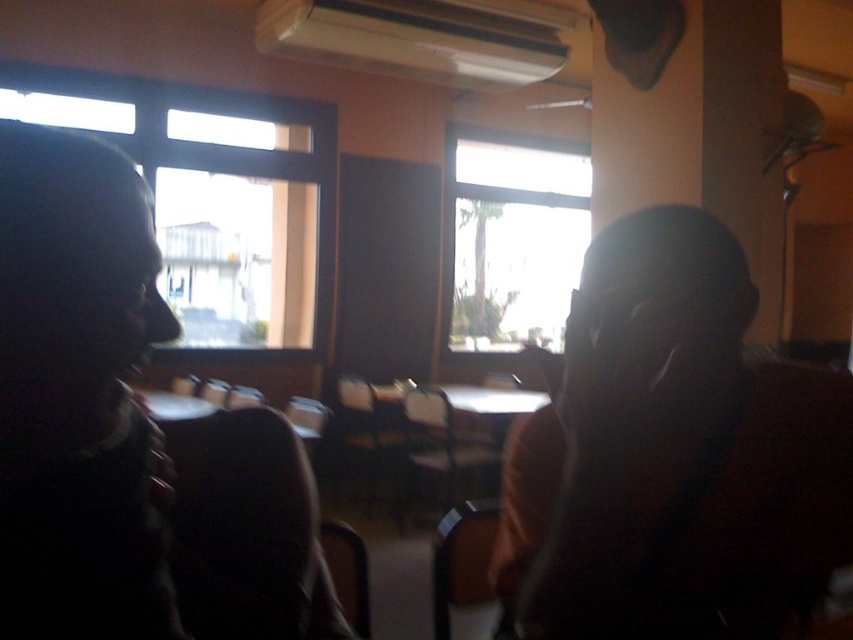
Question: Is dark matte head at center bigger than transparent glass window at center?

Choices:
 (A) no
 (B) yes

Answer: (A)

Question: Which point is closer to the camera?

Choices:
 (A) transparent glass window at left
 (B) dark matte head at center
 (C) transparent glass window at center

Answer: (B)

Question: Does transparent glass window at left have a greater width compared to transparent glass window at center?

Choices:
 (A) no
 (B) yes

Answer: (B)

Question: Which is farther from the dark matte head at center?

Choices:
 (A) transparent glass window at left
 (B) transparent glass window at center

Answer: (B)

Question: Where is dark matte head at center located in relation to transparent glass window at left in the image?

Choices:
 (A) left
 (B) right

Answer: (B)

Question: Estimate the real-world distances between objects in this image. Which object is closer to the transparent glass window at left?

Choices:
 (A) dark matte head at center
 (B) transparent glass window at center

Answer: (B)